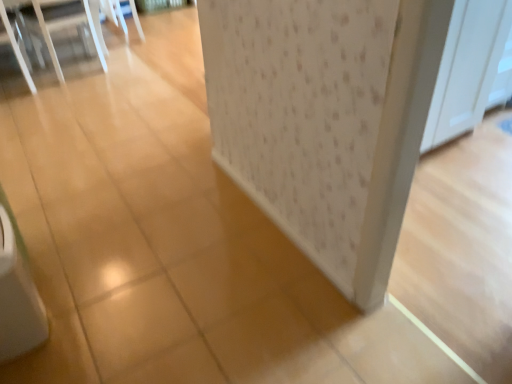
Question: Considering the relative positions of white wood screen door at upper right and clear plastic chairs at upper left in the image provided, is white wood screen door at upper right to the right of clear plastic chairs at upper left from the viewer's perspective?

Choices:
 (A) yes
 (B) no

Answer: (A)

Question: Are white wood screen door at upper right and clear plastic chairs at upper left far apart?

Choices:
 (A) no
 (B) yes

Answer: (B)

Question: Is white wood screen door at upper right next to clear plastic chairs at upper left and touching it?

Choices:
 (A) no
 (B) yes

Answer: (A)

Question: Is white wood screen door at upper right further to camera compared to clear plastic chairs at upper left?

Choices:
 (A) no
 (B) yes

Answer: (A)

Question: From a real-world perspective, is white wood screen door at upper right on clear plastic chairs at upper left?

Choices:
 (A) yes
 (B) no

Answer: (A)

Question: Considering the relative sizes of white wood screen door at upper right and clear plastic chairs at upper left in the image provided, is white wood screen door at upper right taller than clear plastic chairs at upper left?

Choices:
 (A) yes
 (B) no

Answer: (A)

Question: Considering the relative positions of clear plastic chairs at upper left and white wood screen door at upper right in the image provided, is clear plastic chairs at upper left behind white wood screen door at upper right?

Choices:
 (A) no
 (B) yes

Answer: (B)

Question: From a real-world perspective, is clear plastic chairs at upper left under white wood screen door at upper right?

Choices:
 (A) no
 (B) yes

Answer: (B)

Question: Is clear plastic chairs at upper left turned away from white wood screen door at upper right?

Choices:
 (A) yes
 (B) no

Answer: (B)

Question: Can you confirm if clear plastic chairs at upper left is wider than white wood screen door at upper right?

Choices:
 (A) no
 (B) yes

Answer: (B)

Question: Is white wood screen door at upper right located within clear plastic chairs at upper left?

Choices:
 (A) yes
 (B) no

Answer: (B)

Question: Does clear plastic chairs at upper left have a lesser height compared to white wood screen door at upper right?

Choices:
 (A) yes
 (B) no

Answer: (A)

Question: Considering the positions of point (445, 102) and point (54, 56), is point (445, 102) closer or farther from the camera than point (54, 56)?

Choices:
 (A) closer
 (B) farther

Answer: (A)